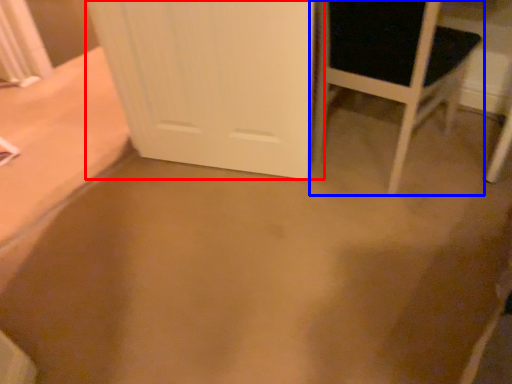
Question: Which of the following is the closest to the observer, door (highlighted by a red box) or chair (highlighted by a blue box)?

Choices:
 (A) door
 (B) chair

Answer: (B)